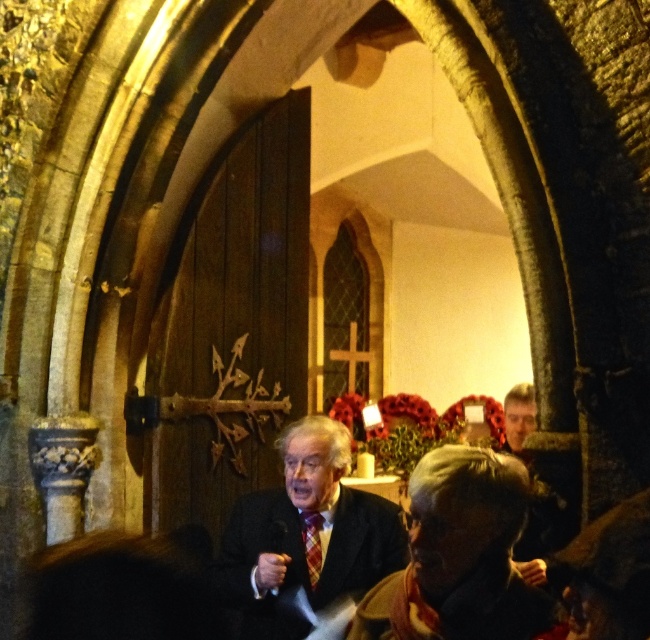
Question: Considering the relative positions of matte black suit at center and plaid fabric tie at center in the image provided, where is matte black suit at center located with respect to plaid fabric tie at center?

Choices:
 (A) right
 (B) left

Answer: (B)

Question: Which object appears farthest from the camera in this image?

Choices:
 (A) dark brown leather jacket at lower center
 (B) plaid fabric tie at center

Answer: (B)

Question: Which of the following is the closest to the observer?

Choices:
 (A) plaid fabric tie at center
 (B) dark brown leather jacket at lower center
 (C) matte black suit at center

Answer: (B)

Question: Is dark brown leather jacket at lower center bigger than matte black suit at center?

Choices:
 (A) yes
 (B) no

Answer: (B)

Question: Does dark brown leather jacket at lower center have a greater width compared to plaid fabric tie at center?

Choices:
 (A) no
 (B) yes

Answer: (B)

Question: Based on their relative distances, which object is farther from the dark brown leather jacket at lower center?

Choices:
 (A) plaid fabric tie at center
 (B) matte black suit at center

Answer: (A)